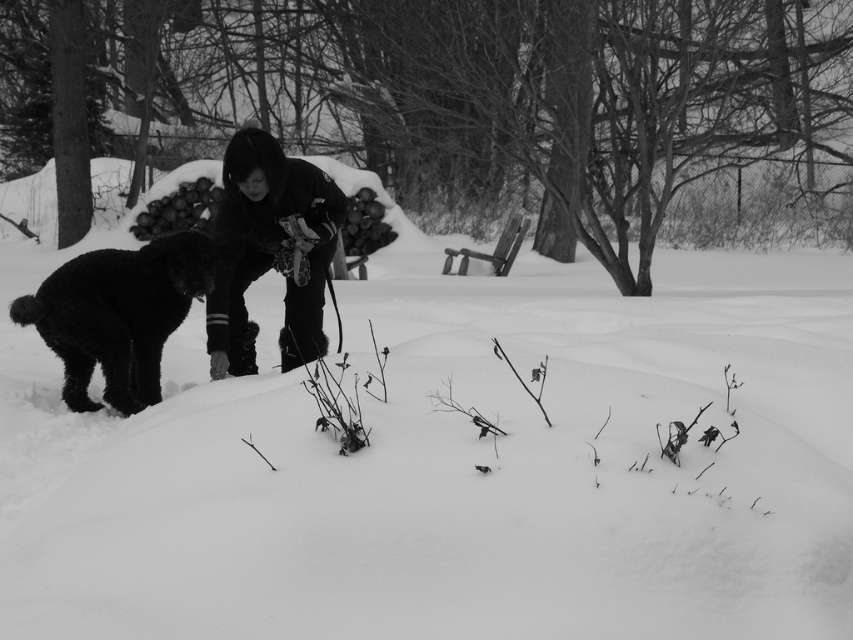
Question: Does dark fabric jacket at center appear on the left side of black fur dog at left?

Choices:
 (A) yes
 (B) no

Answer: (B)

Question: Which point appears closest to the camera in this image?

Choices:
 (A) (157, 314)
 (B) (306, 259)

Answer: (B)

Question: Can you confirm if dark fabric jacket at center is positioned below black fur dog at left?

Choices:
 (A) no
 (B) yes

Answer: (A)

Question: Does dark fabric jacket at center appear under black fur dog at left?

Choices:
 (A) no
 (B) yes

Answer: (A)